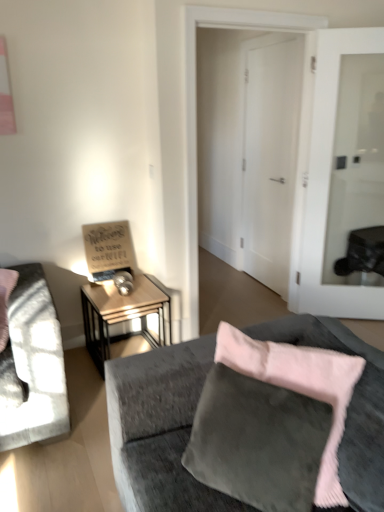
Question: From a real-world perspective, relative to velvet gray couch at lower right, is metallic silver table lamp at left vertically above or below?

Choices:
 (A) below
 (B) above

Answer: (B)

Question: From their relative heights in the image, would you say metallic silver table lamp at left is taller or shorter than velvet gray couch at lower right?

Choices:
 (A) tall
 (B) short

Answer: (B)

Question: Which is farther from the metallic silver table lamp at left?

Choices:
 (A) velvet gray couch at lower right
 (B) wooden sign at left
 (C) wooden side table at center left
 (D) white smooth door at center, the 2th door positioned from the right
 (E) white glass door at center, the 1th door in the right-to-left sequence

Answer: (D)

Question: Estimate the real-world distances between objects in this image. Which object is farther from the velvet gray couch at lower right?

Choices:
 (A) white glass door at center, the 2th door from the left
 (B) wooden side table at center left
 (C) metallic silver table lamp at left
 (D) white smooth door at center, the first door from the left
 (E) wooden sign at left

Answer: (D)